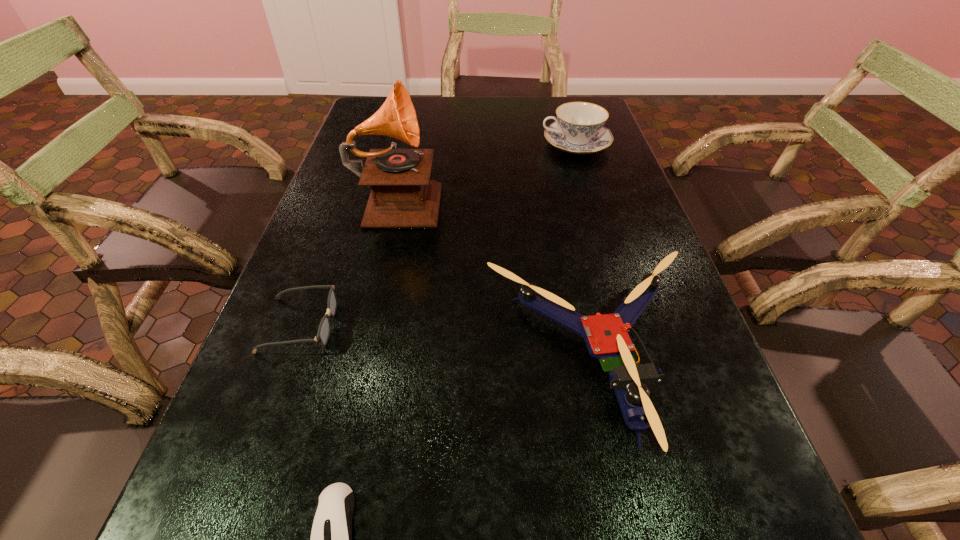
The image size is (960, 540). Identify the location of blank space at the far right corner of the desktop. (607, 127).

I want to click on free space that is in between the second shortest object and the phonograph record, so click(x=349, y=262).

Where is `free space between the fourth tallest object and the drone`? free space between the fourth tallest object and the drone is located at coordinates (447, 342).

You are a GUI agent. You are given a task and a screenshot of the screen. Output one action in this format:
    pyautogui.click(x=<x>, y=<y>)
    Task: Click on the vacant space that's between the chinaware and the phonograph record
    This screenshot has width=960, height=540.
    Given the screenshot: What is the action you would take?
    pyautogui.click(x=487, y=171)

Identify the location of free spot between the drone and the chinaware. This screenshot has height=540, width=960. (586, 251).

Identify the location of vacant area between the tallest object and the farthest object. (487, 171).

The image size is (960, 540). I want to click on unoccupied area between the chinaware and the spectacles, so click(x=438, y=235).

Identify the location of empty space between the drone and the spectacles. (447, 342).

Where is `object that stands as the closest to the nearest object`? The height and width of the screenshot is (540, 960). object that stands as the closest to the nearest object is located at coordinates (606, 336).

Locate an element on the screen. object that is the closest to the nearest object is located at coordinates (606, 336).